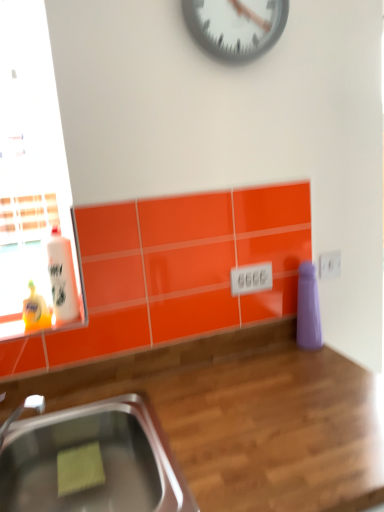
Locate an element on the screen. metallic gray clock at upper center is located at coordinates (236, 26).

Identify the location of stainless steel sink at lower left. Image resolution: width=384 pixels, height=512 pixels. tap(102, 459).

Where is `white glossy bottle at left`? white glossy bottle at left is located at coordinates (62, 277).

You are a GUI agent. You are given a task and a screenshot of the screen. Output one action in this format:
    pyautogui.click(x=<x>, y=<y>)
    Task: Click on the metallic gray clock at upper center
    The image size is (384, 512).
    Given the screenshot: What is the action you would take?
    pyautogui.click(x=236, y=26)

Are metallic gray clock at upper center and white glossy bottle at left located far from each other?

metallic gray clock at upper center is actually quite close to white glossy bottle at left.

From the image's perspective, is metallic gray clock at upper center below white glossy bottle at left?

No, from the image's perspective, metallic gray clock at upper center is not below white glossy bottle at left.

Between metallic gray clock at upper center and white glossy bottle at left, which one is positioned in front?

metallic gray clock at upper center is closer to the camera.

Is white glossy bottle at left surrounded by metallic gray clock at upper center?

No, white glossy bottle at left is located outside of metallic gray clock at upper center.

Between white glossy bottle at left and metallic gray clock at upper center, which one is positioned behind?

white glossy bottle at left.

Is white glossy bottle at left not close to metallic gray clock at upper center?

No, white glossy bottle at left is not far away from metallic gray clock at upper center.

From the image's perspective, which object appears higher, white glossy bottle at left or metallic gray clock at upper center?

metallic gray clock at upper center is shown above in the image.

Measure the distance from white glossy bottle at left to metallic gray clock at upper center.

white glossy bottle at left is 75.69 centimeters away from metallic gray clock at upper center.

Can you tell me how much metallic gray clock at upper center and wooden at lower right differ in facing direction?

0.00179 degrees.

Find the location of `wall clock lying above the wooden at lower right (from the image's perspective)`. wall clock lying above the wooden at lower right (from the image's perspective) is located at coordinates (236, 26).

Considering the sizes of objects metallic gray clock at upper center and wooden at lower right in the image provided, who is bigger, metallic gray clock at upper center or wooden at lower right?

Bigger between the two is wooden at lower right.

Does metallic gray clock at upper center have a greater height compared to wooden at lower right?

No, metallic gray clock at upper center is not taller than wooden at lower right.

How distant is stainless steel sink at lower left from white glossy bottle at left?

They are 15.23 inches apart.

From a real-world perspective, is stainless steel sink at lower left physically above white glossy bottle at left?

Actually, stainless steel sink at lower left is physically below white glossy bottle at left in the real world.

Where is `bottle above the stainless steel sink at lower left (from a real-world perspective)`? Image resolution: width=384 pixels, height=512 pixels. bottle above the stainless steel sink at lower left (from a real-world perspective) is located at coordinates (62, 277).

Between stainless steel sink at lower left and white glossy bottle at left, which one has larger width?

stainless steel sink at lower left.

In the image, is white glossy bottle at left positioned in front of or behind wooden at lower right?

white glossy bottle at left is behind wooden at lower right.

Which of these two, white glossy bottle at left or wooden at lower right, is bigger?

wooden at lower right.

From the image's perspective, does white glossy bottle at left appear lower than wooden at lower right?

No.

Is white glossy bottle at left facing away from wooden at lower right?

No, white glossy bottle at left is not facing away from wooden at lower right.

Which is less distant, (62, 250) or (115, 481)?

Clearly, point (62, 250) is more distant from the camera than point (115, 481).

Does white glossy bottle at left turn towards stainless steel sink at lower left?

No.

From a real-world perspective, is white glossy bottle at left above or below stainless steel sink at lower left?

In terms of real-world spatial position, white glossy bottle at left is above stainless steel sink at lower left.

Is wooden at lower right placed right next to metallic gray clock at upper center?

wooden at lower right is not next to metallic gray clock at upper center, and they're not touching.

Would you say wooden at lower right is inside or outside metallic gray clock at upper center?

wooden at lower right is not enclosed by metallic gray clock at upper center.

Is wooden at lower right in front of metallic gray clock at upper center?

Yes, wooden at lower right is closer to the camera.

Between wooden at lower right and metallic gray clock at upper center, which one has more height?

wooden at lower right is taller.

The width and height of the screenshot is (384, 512). In the image, there is a metallic gray clock at upper center. Find the location of `bottle below it (from the image's perspective)`. bottle below it (from the image's perspective) is located at coordinates (62, 277).

What are the coordinates of `bottle behind the metallic gray clock at upper center` in the screenshot? It's located at (62, 277).

From the image, which object appears to be farther from metallic gray clock at upper center, white glossy bottle at left or wooden at lower right?

wooden at lower right lies further to metallic gray clock at upper center than the other object.

When comparing their distances from metallic gray clock at upper center, does stainless steel sink at lower left or white glossy bottle at left seem further?

The object further to metallic gray clock at upper center is stainless steel sink at lower left.

Based on their spatial positions, is stainless steel sink at lower left or wooden at lower right closer to metallic gray clock at upper center?

wooden at lower right is closer to metallic gray clock at upper center.

Estimate the real-world distances between objects in this image. Which object is further from white glossy bottle at left, stainless steel sink at lower left or wooden at lower right?

Based on the image, wooden at lower right appears to be further to white glossy bottle at left.

From the image, which object appears to be farther from wooden at lower right, white glossy bottle at left or stainless steel sink at lower left?

Among the two, white glossy bottle at left is located further to wooden at lower right.

From the image, which object appears to be nearer to stainless steel sink at lower left, wooden at lower right or white glossy bottle at left?

The object closer to stainless steel sink at lower left is wooden at lower right.

When comparing their distances from metallic gray clock at upper center, does white glossy bottle at left or stainless steel sink at lower left seem further?

stainless steel sink at lower left.

Which object lies further to the anchor point white glossy bottle at left, wooden at lower right or metallic gray clock at upper center?

metallic gray clock at upper center is positioned further to the anchor white glossy bottle at left.

This screenshot has height=512, width=384. Find the location of `sink between metallic gray clock at upper center and wooden at lower right in the vertical direction`. sink between metallic gray clock at upper center and wooden at lower right in the vertical direction is located at coordinates (102, 459).

This screenshot has width=384, height=512. What are the coordinates of `sink located between white glossy bottle at left and wooden at lower right in the left-right direction` in the screenshot? It's located at (102, 459).

This screenshot has width=384, height=512. I want to click on bottle between metallic gray clock at upper center and wooden at lower right vertically, so click(62, 277).

Where is `bottle that lies between metallic gray clock at upper center and stainless steel sink at lower left from top to bottom`? This screenshot has width=384, height=512. bottle that lies between metallic gray clock at upper center and stainless steel sink at lower left from top to bottom is located at coordinates (62, 277).